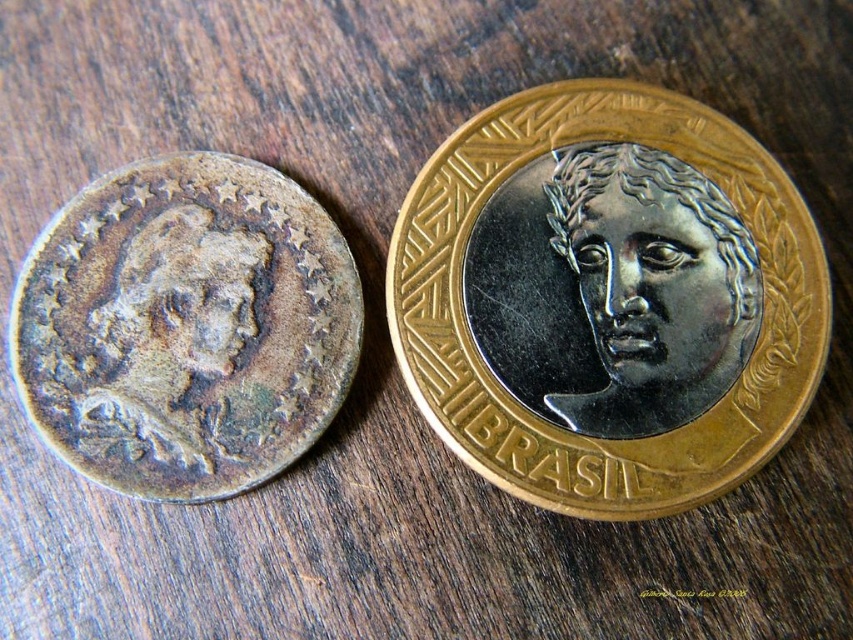
Can you confirm if patina bronze coin at left is bigger than satin silver face at center?

Yes.

Which is more to the right, patina bronze coin at left or satin silver face at center?

From the viewer's perspective, satin silver face at center appears more on the right side.

Describe the element at coordinates (184, 326) in the screenshot. I see `patina bronze coin at left` at that location.

Where is `patina bronze coin at left`? This screenshot has height=640, width=853. patina bronze coin at left is located at coordinates (184, 326).

Does gold-plated coin at center appear over satin silver face at center?

No.

In the scene shown: Can you confirm if gold-plated coin at center is smaller than satin silver face at center?

No.

Is point (718, 308) less distant than point (621, 314)?

Yes.

Where is `gold-plated coin at center`? gold-plated coin at center is located at coordinates (607, 298).

Is gold-plated coin at center shorter than patina bronze coin at left?

No, gold-plated coin at center is not shorter than patina bronze coin at left.

Who is positioned more to the right, gold-plated coin at center or patina bronze coin at left?

gold-plated coin at center is more to the right.

Who is more distant from viewer, (763, 417) or (308, 419)?

The point (308, 419) is behind.

Identify the location of gold-plated coin at center. This screenshot has height=640, width=853. (607, 298).